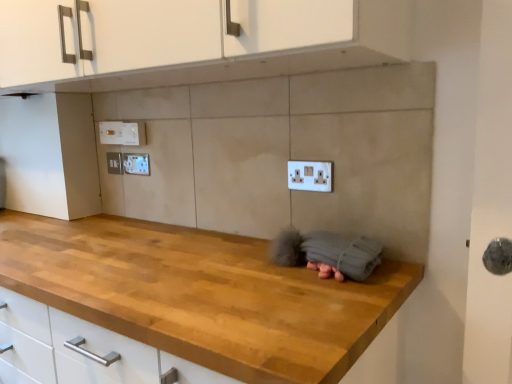
Question: Is the position of white plastic electric outlet at upper left, marked as the 3th electric outlet in a front-to-back arrangement, more distant than that of white plastic electric outlet at upper left, the second electric outlet when ordered from front to back?

Choices:
 (A) no
 (B) yes

Answer: (B)

Question: Is white plastic electric outlet at upper left, marked as the 3th electric outlet in a front-to-back arrangement, facing towards white plastic electric outlet at upper left, the third electric outlet when ordered from back to front?

Choices:
 (A) yes
 (B) no

Answer: (B)

Question: Is white plastic electric outlet at upper left, the second electric outlet positioned from the back, not close to white plastic electric outlet at upper left, the third electric outlet when ordered from back to front?

Choices:
 (A) no
 (B) yes

Answer: (A)

Question: Is white plastic electric outlet at upper left, the third electric outlet when ordered from back to front, completely or partially inside white plastic electric outlet at upper left, marked as the 3th electric outlet in a front-to-back arrangement?

Choices:
 (A) yes
 (B) no

Answer: (B)

Question: Is white plastic electric outlet at upper left, marked as the 3th electric outlet in a front-to-back arrangement, positioned with its back to white plastic electric outlet at upper left, the second electric outlet when ordered from front to back?

Choices:
 (A) no
 (B) yes

Answer: (A)

Question: Looking at the image, does white plastic electric outlet at upper left, the third electric outlet when ordered from back to front, seem bigger or smaller compared to white plastic electric outlet at center, placed as the fourth electric outlet when sorted from back to front?

Choices:
 (A) small
 (B) big

Answer: (A)

Question: Is white plastic electric outlet at upper left, the second electric outlet when ordered from front to back, to the left or to the right of white plastic electric outlet at center, which is counted as the 1th electric outlet, starting from the front, in the image?

Choices:
 (A) left
 (B) right

Answer: (A)

Question: From the image's perspective, is white plastic electric outlet at upper left, which is the third electric outlet in left-to-right order, positioned above or below white plastic electric outlet at center, placed as the fourth electric outlet when sorted from back to front?

Choices:
 (A) above
 (B) below

Answer: (A)

Question: Considering the positions of white plastic electric outlet at upper left, which is the third electric outlet in left-to-right order, and white plastic electric outlet at center, the first electric outlet positioned from the right, in the image, is white plastic electric outlet at upper left, which is the third electric outlet in left-to-right order, wider or thinner than white plastic electric outlet at center, the first electric outlet positioned from the right,?

Choices:
 (A) thin
 (B) wide

Answer: (A)

Question: From a real-world perspective, is white plastic electric outlet at upper left, the second electric outlet positioned from the right, above or below white plastic electric outlet at upper left, which is the third electric outlet from right to left?

Choices:
 (A) below
 (B) above

Answer: (A)

Question: From the image's perspective, is white plastic electric outlet at upper left, which is the third electric outlet in left-to-right order, above or below white plastic electric outlet at upper left, positioned as the 2th electric outlet in left-to-right order?

Choices:
 (A) below
 (B) above

Answer: (A)

Question: Considering the positions of point (135, 157) and point (100, 129), is point (135, 157) closer or farther from the camera than point (100, 129)?

Choices:
 (A) farther
 (B) closer

Answer: (B)

Question: Is white plastic electric outlet at upper left, the second electric outlet positioned from the right, to the left or to the right of white plastic electric outlet at upper left, positioned as the 2th electric outlet in left-to-right order, in the image?

Choices:
 (A) left
 (B) right

Answer: (B)

Question: In terms of size, does white plastic electric outlet at center, which is the fourth electric outlet in left-to-right order, appear bigger or smaller than white plastic electric outlet at upper left, which is the third electric outlet in left-to-right order?

Choices:
 (A) small
 (B) big

Answer: (B)

Question: Considering their positions, is white plastic electric outlet at center, which is counted as the 1th electric outlet, starting from the front, located in front of or behind white plastic electric outlet at upper left, the third electric outlet when ordered from back to front?

Choices:
 (A) behind
 (B) front

Answer: (B)